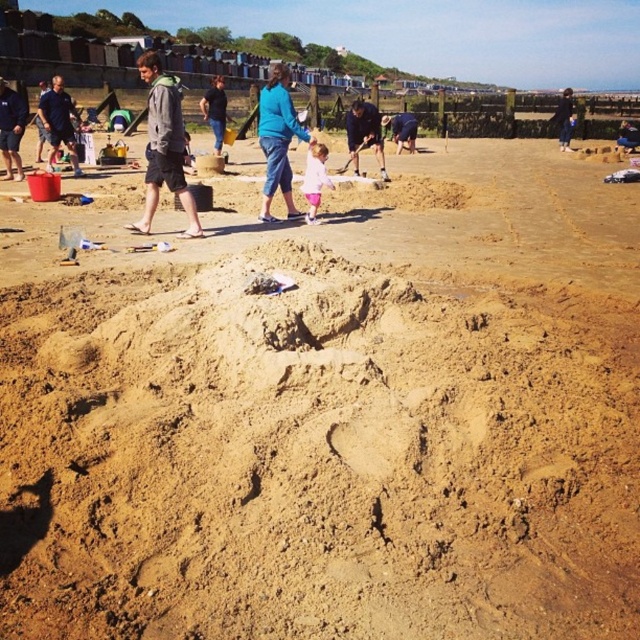
Where is the blue denim jeans at center located in the image?

The blue denim jeans at center is located at point [216,109] in the image.

You are a photographer trying to capture a photo of the pink fabric pants at center and the dark blue hoodie at upper center. Which object should you focus on first if you want to ensure both are in focus without adjusting your camera settings?

The pink fabric pants at center is not as tall as the dark blue hoodie at upper center, so you should focus on the dark blue hoodie at upper center first because it is closer to the camera.